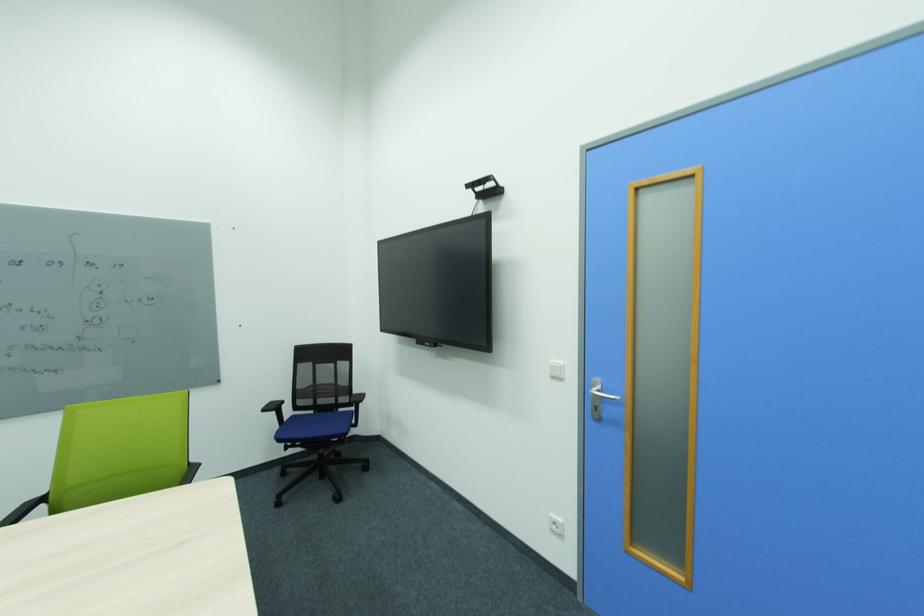
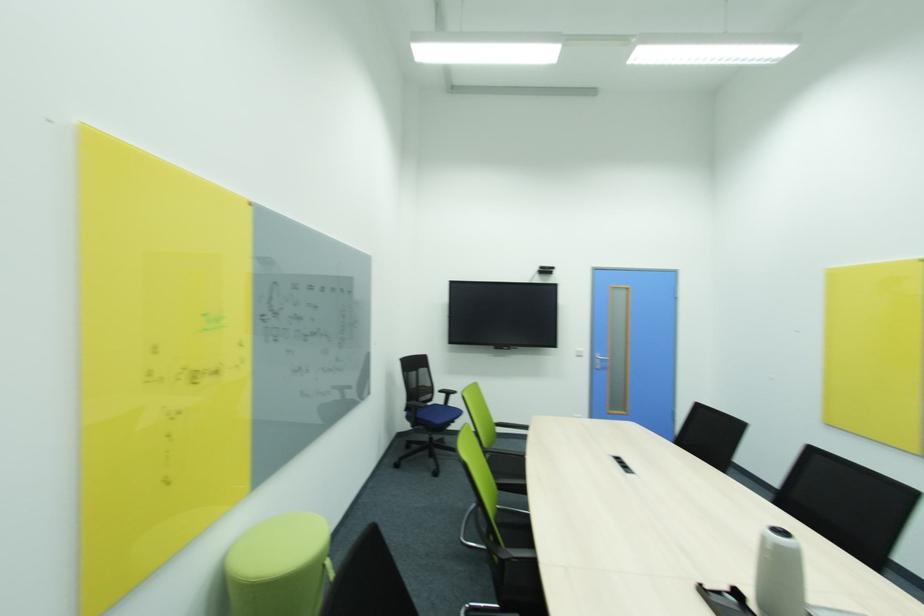
In the second image, find the point that corresponds to point (347, 365) in the first image.

(428, 371)